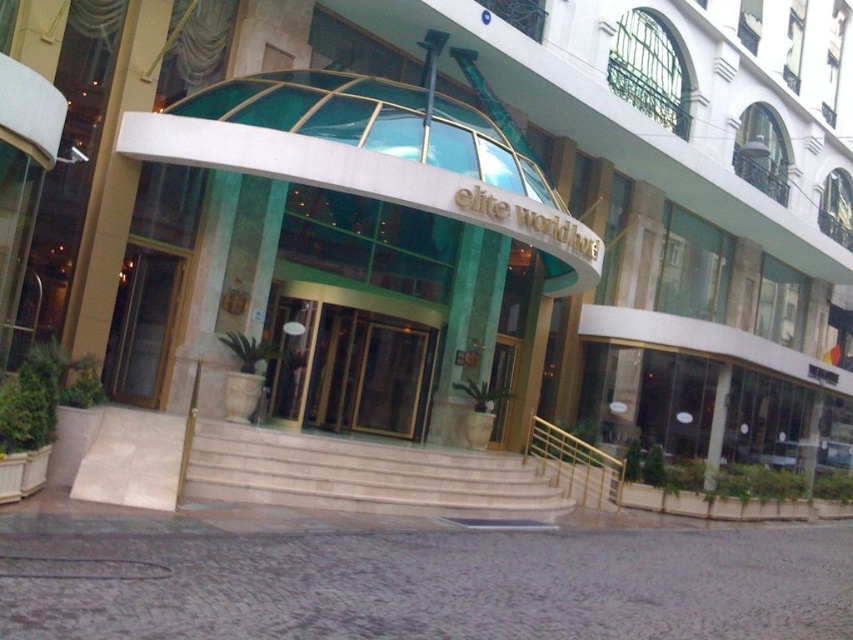
Between gold/glass door at center and matte glass door at left, which one has more height?

matte glass door at left

Does gold/glass door at center appear under matte glass door at left?

Indeed, gold/glass door at center is positioned under matte glass door at left.

Which is behind, point (305, 416) or point (125, 330)?

Positioned behind is point (305, 416).

Find the location of `gold/glass door at center`. gold/glass door at center is located at coordinates (369, 374).